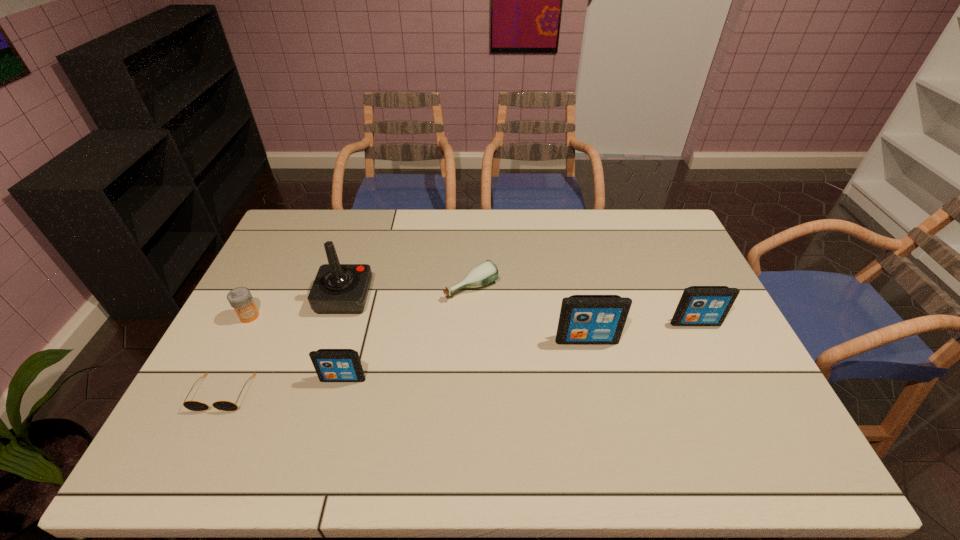
This screenshot has width=960, height=540. Identify the location of object that is positioned at the near left corner. (190, 405).

In the image, there is a desktop. At what (x,y) coordinates should I click in order to perform the action: click on vacant region at the far edge. Please return your answer as a coordinate pair (x, y). This screenshot has width=960, height=540. Looking at the image, I should click on (548, 222).

In the image, there is a desktop. Find the location of `vacant space at the left edge`. vacant space at the left edge is located at coordinates (263, 273).

At what (x,y) coordinates should I click in order to perform the action: click on free space at the right edge of the desktop. Please return your answer as a coordinate pair (x, y). Looking at the image, I should click on (748, 380).

This screenshot has width=960, height=540. Find the location of `free region at the far left corner of the desktop`. free region at the far left corner of the desktop is located at coordinates (325, 217).

Where is `free space between the shortest iPod and the second iPod from left to right`? free space between the shortest iPod and the second iPod from left to right is located at coordinates (465, 359).

Where is `vacant space that's between the fourth shortest object and the sixth shortest object`? This screenshot has height=540, width=960. vacant space that's between the fourth shortest object and the sixth shortest object is located at coordinates (465, 359).

The image size is (960, 540). Find the location of `vacant space that is in between the fifth object from left to right and the fourth tallest object`. vacant space that is in between the fifth object from left to right and the fourth tallest object is located at coordinates (407, 333).

Find the location of `free space between the rightmost iPod and the shortest iPod`. free space between the rightmost iPod and the shortest iPod is located at coordinates (519, 350).

At what (x,y) coordinates should I click in order to perform the action: click on unoccupied area between the second iPod from right to left and the medicine. Please return your answer as a coordinate pair (x, y). Looking at the image, I should click on (419, 328).